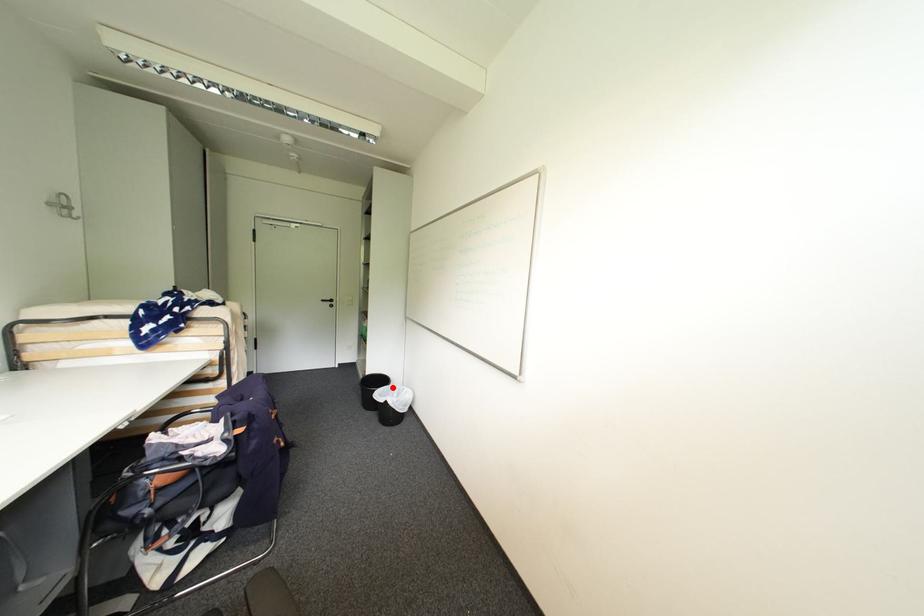
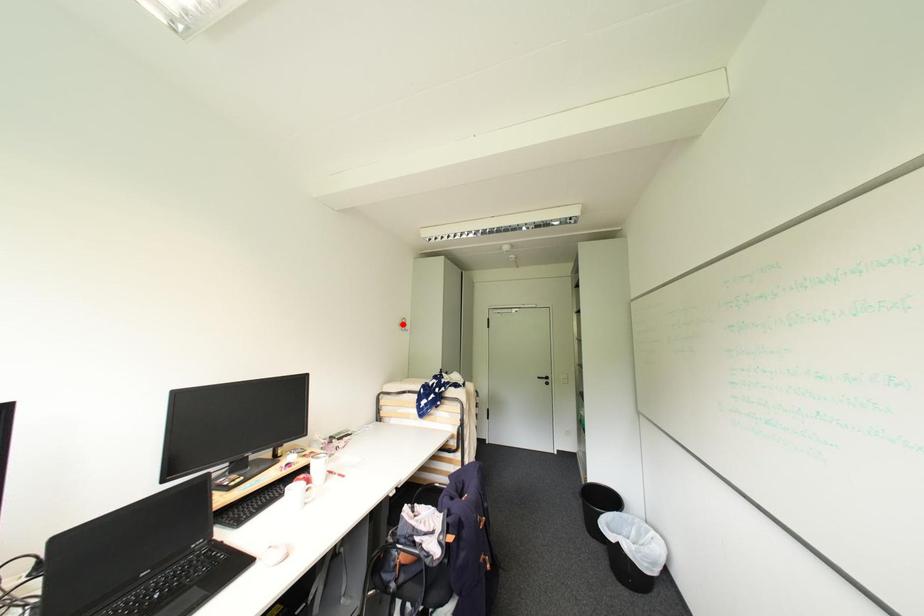
I am providing you with two images of the same scene from different viewpoints. A red point is marked on the first image and another point is marked on the second image. Is the red point in image1 aligned with the point shown in image2?

No